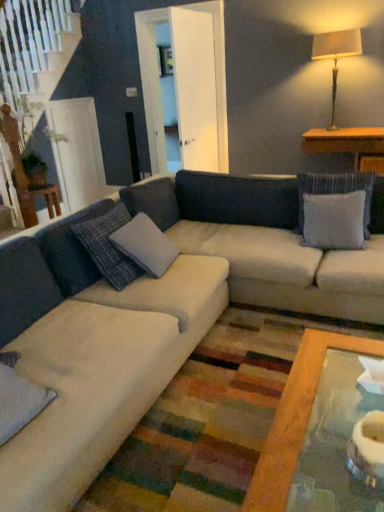
Question: From a real-world perspective, is wooden table at right physically located above or below matte beige lampshade at upper right?

Choices:
 (A) above
 (B) below

Answer: (B)

Question: Considering the positions of point (354, 151) and point (332, 101), is point (354, 151) closer or farther from the camera than point (332, 101)?

Choices:
 (A) closer
 (B) farther

Answer: (A)

Question: Which of these objects is positioned farthest from the velvety gray pillow at lower left, which appears as the 1th pillow when viewed from the front?

Choices:
 (A) gray fabric pillow at upper right, which appears as the third pillow when viewed from the front
 (B) matte beige lampshade at upper right
 (C) wooden table at right
 (D) beige fabric couch at center
 (E) gray fabric pillow at center, which ranks as the 2th pillow in front-to-back order

Answer: (B)

Question: Which object is positioned farthest from the beige fabric couch at center?

Choices:
 (A) velvety gray pillow at lower left, the 3th pillow from the right
 (B) gray fabric pillow at upper right, which is counted as the 1th pillow, starting from the back
 (C) matte beige lampshade at upper right
 (D) gray fabric pillow at center, which ranks as the 2th pillow in front-to-back order
 (E) wooden table at right

Answer: (C)